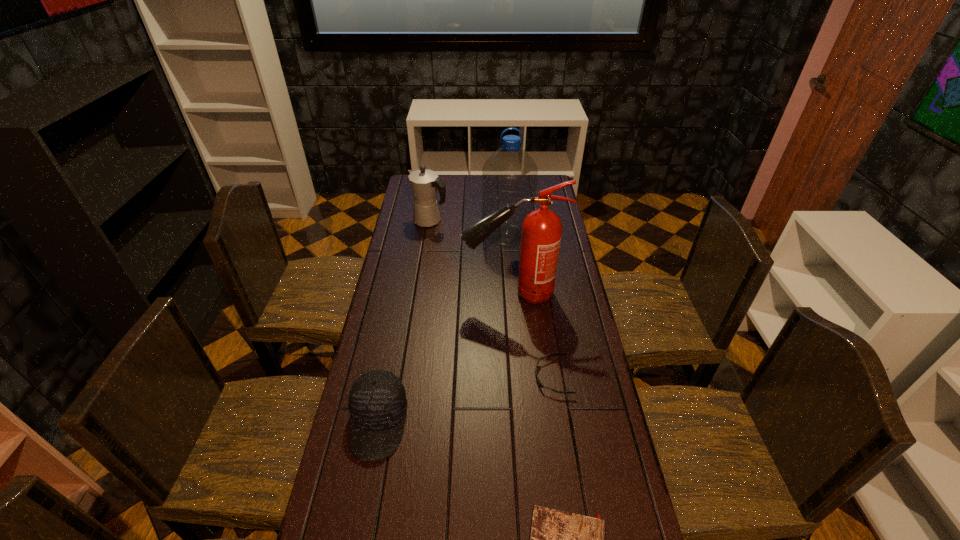
In the image, there is a desktop. Identify the location of free space at the left edge. The height and width of the screenshot is (540, 960). (356, 517).

At what (x,y) coordinates should I click in order to perform the action: click on free space at the right edge of the desktop. Please return your answer as a coordinate pair (x, y). Looking at the image, I should click on (603, 454).

Locate an element on the screen. This screenshot has height=540, width=960. vacant space that's between the third farthest object and the water jug is located at coordinates (510, 265).

Where is `free space between the water jug and the sunglasses`? This screenshot has height=540, width=960. free space between the water jug and the sunglasses is located at coordinates (530, 306).

What are the coordinates of `free spot between the third farthest object and the coffeepot` in the screenshot? It's located at (471, 258).

Find the location of `free space between the sunglasses and the third farthest object`. free space between the sunglasses and the third farthest object is located at coordinates (533, 335).

Locate an element on the screen. vacant space in between the fourth shortest object and the third shortest object is located at coordinates (404, 322).

Image resolution: width=960 pixels, height=540 pixels. I want to click on vacant region between the baseball cap and the fourth shortest object, so click(404, 322).

Locate an element on the screen. The width and height of the screenshot is (960, 540). free space between the baseball cap and the third tallest object is located at coordinates (404, 322).

Where is `empty space between the third farthest object and the water jug`? This screenshot has height=540, width=960. empty space between the third farthest object and the water jug is located at coordinates (510, 265).